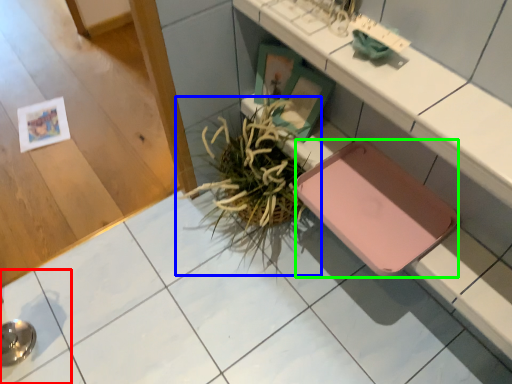
Question: Which object is positioned closest to square (highlighted by a red box)? Select from houseplant (highlighted by a blue box) and pad (highlighted by a green box).

Choices:
 (A) houseplant
 (B) pad

Answer: (A)